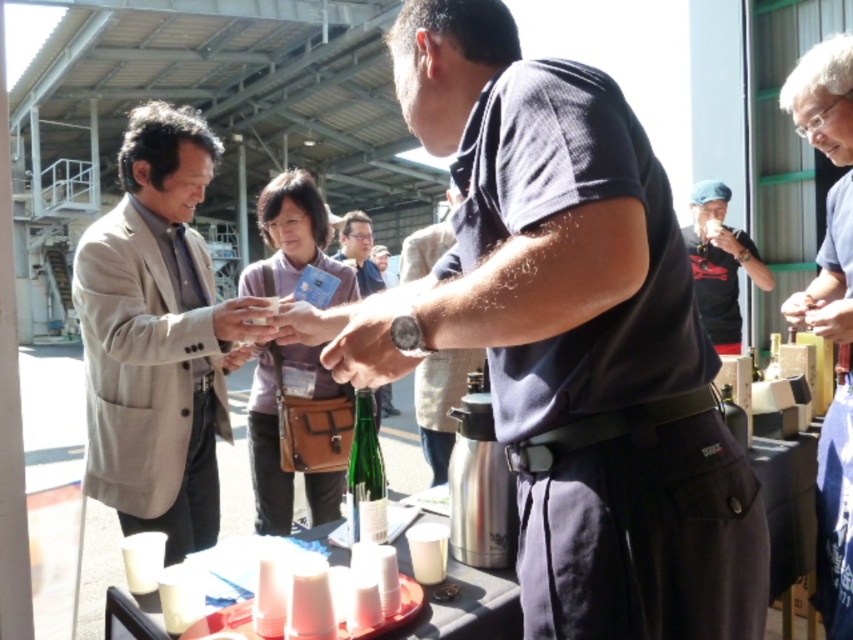
From the picture: Does dark gray t-shirt at center appear on the left side of white matte bottle at upper right?

Yes, dark gray t-shirt at center is to the left of white matte bottle at upper right.

Can you confirm if dark gray t-shirt at center is wider than white matte bottle at upper right?

Yes.

Is point (611, 529) less distant than point (824, 234)?

Yes, point (611, 529) is closer to viewer.

You are a GUI agent. You are given a task and a screenshot of the screen. Output one action in this format:
    pyautogui.click(x=<x>, y=<y>)
    Task: Click on the dark gray t-shirt at center
    The height and width of the screenshot is (640, 853).
    Given the screenshot: What is the action you would take?
    pyautogui.click(x=567, y=337)

Between white matte bottle at upper right and matte black shirt at center, which one is positioned higher?

white matte bottle at upper right is above.

Does white matte bottle at upper right appear on the left side of matte black shirt at center?

Incorrect, white matte bottle at upper right is not on the left side of matte black shirt at center.

Is point (844, 97) positioned after point (433, 484)?

That is False.

The height and width of the screenshot is (640, 853). Find the location of `white matte bottle at upper right`. white matte bottle at upper right is located at coordinates (833, 408).

Is the position of black matte shirt at upper right less distant than that of green glass bottle at center?

That is False.

How far apart are black matte shirt at upper right and green glass bottle at center?

The distance of black matte shirt at upper right from green glass bottle at center is 3.12 meters.

Locate an element on the screen. The image size is (853, 640). black matte shirt at upper right is located at coordinates (718, 264).